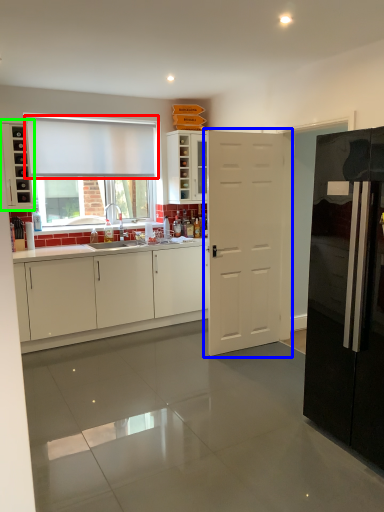
Question: Based on their relative distances, which object is nearer to curtain (highlighted by a red box)? Choose from door (highlighted by a blue box) and cabinetry (highlighted by a green box).

Choices:
 (A) door
 (B) cabinetry

Answer: (B)